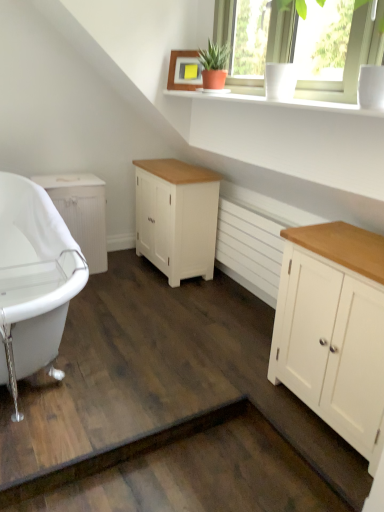
I want to click on empty space that is ontop of white painted wood cabinet at right, which is counted as the first cabinetry, starting from the front, so click(347, 244).